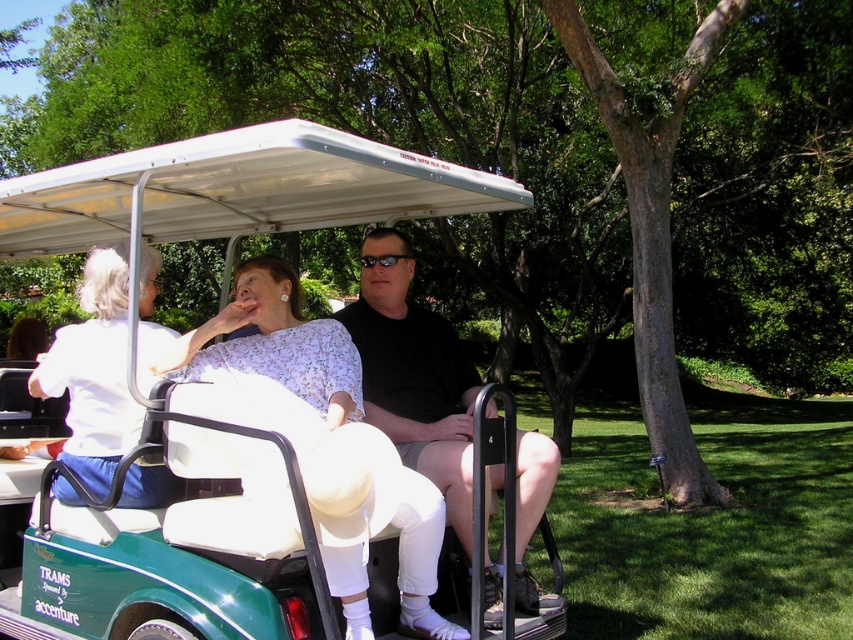
Question: Does green matte golf cart at center have a larger size compared to floral fabric blouse at center?

Choices:
 (A) no
 (B) yes

Answer: (B)

Question: Which object appears farthest from the camera in this image?

Choices:
 (A) green matte golf cart at center
 (B) floral fabric blouse at center
 (C) black plastic sunglasses at center

Answer: (C)

Question: Which object is positioned closest to the black plastic sunglasses at center?

Choices:
 (A) floral fabric blouse at center
 (B) black matte shirt at center

Answer: (B)

Question: Which point is closer to the camera taking this photo?

Choices:
 (A) (93, 192)
 (B) (109, 196)
 (C) (376, 259)
 (D) (541, 483)

Answer: (D)

Question: From the image, what is the correct spatial relationship of floral fabric blouse at center in relation to black plastic sunglasses at center?

Choices:
 (A) left
 (B) right

Answer: (A)

Question: Can you confirm if white matte canopy at upper center is positioned below black plastic sunglasses at center?

Choices:
 (A) no
 (B) yes

Answer: (A)